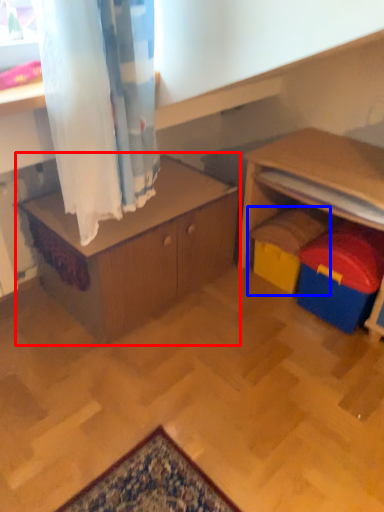
Question: Among these objects, which one is nearest to the camera, table (highlighted by a red box) or toy (highlighted by a blue box)?

Choices:
 (A) table
 (B) toy

Answer: (A)